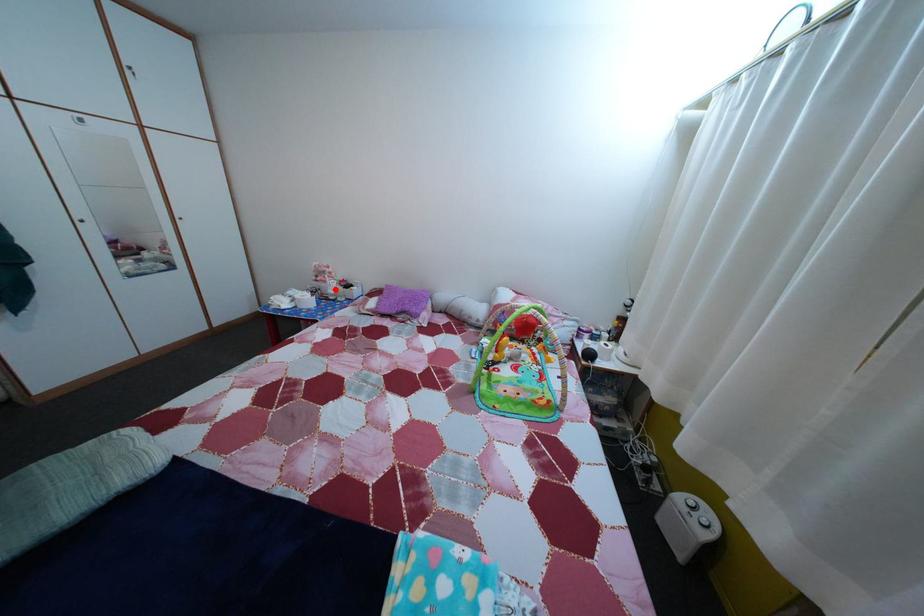
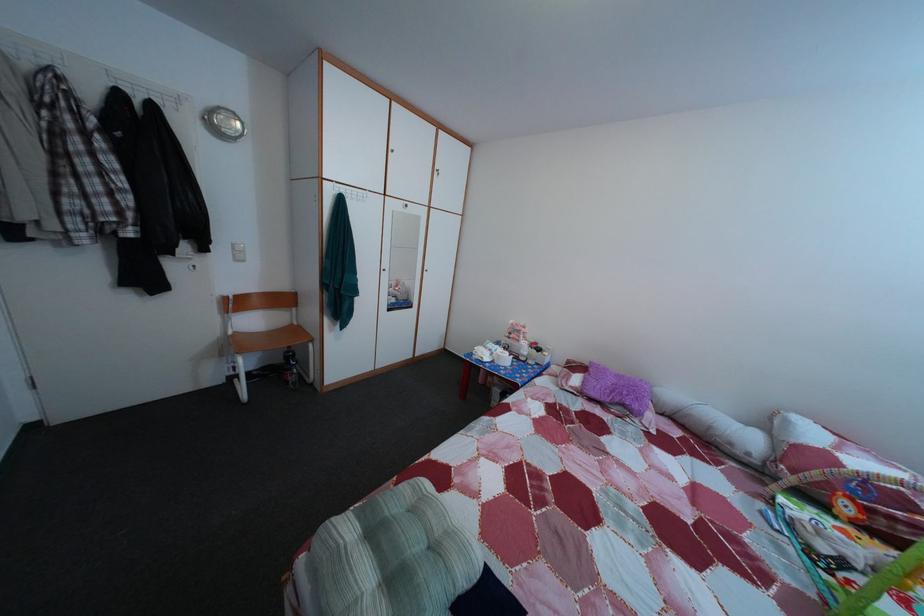
The point at the highlighted location is marked in the first image. Where is the corresponding point in the second image?

(528, 349)